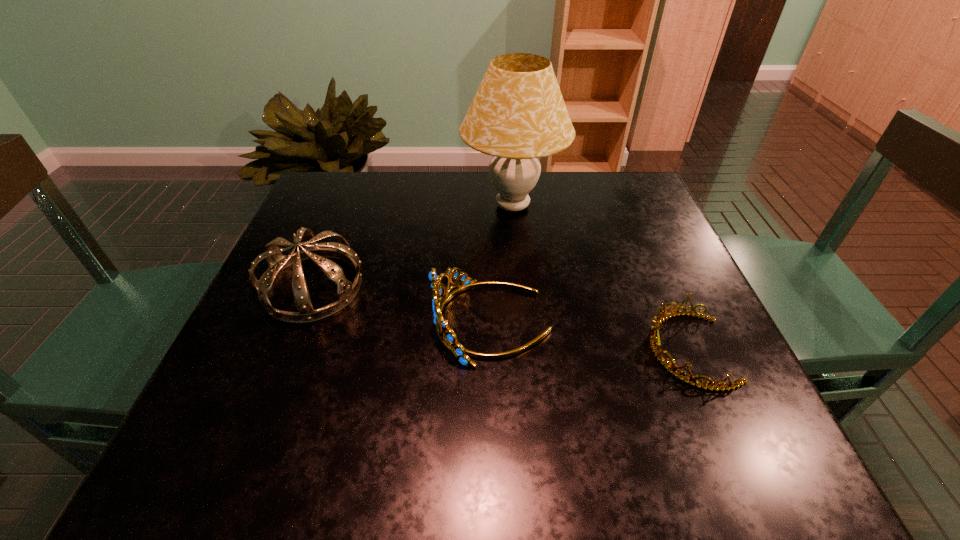
Find the location of a particular element. Image resolution: width=960 pixels, height=540 pixels. free spot located 0.110m on the front-facing side of the second tiara from left to right is located at coordinates (376, 322).

Identify the location of free space located on the front-facing side of the shortest tiara. (613, 350).

You are a GUI agent. You are given a task and a screenshot of the screen. Output one action in this format:
    pyautogui.click(x=<x>, y=<y>)
    Task: Click on the vacant space located on the front-facing side of the shortest tiara
    This screenshot has height=540, width=960.
    Given the screenshot: What is the action you would take?
    coord(596,350)

At what (x,y) coordinates should I click in order to perform the action: click on vacant space located 0.320m on the front-facing side of the shortest tiara. Please return your answer as a coordinate pair (x, y). This screenshot has width=960, height=540. Looking at the image, I should click on (469, 350).

Image resolution: width=960 pixels, height=540 pixels. Identify the location of object located in the far edge section of the desktop. (518, 115).

Locate an element on the screen. object that is at the left edge is located at coordinates (346, 291).

At what (x,y) coordinates should I click in order to perform the action: click on object that is at the right edge. Please return your answer as a coordinate pair (x, y). Looking at the image, I should click on (656, 347).

The width and height of the screenshot is (960, 540). Identify the location of vacant space at the far edge of the desktop. (473, 206).

Image resolution: width=960 pixels, height=540 pixels. In order to click on free location at the near edge in this screenshot , I will do `click(440, 432)`.

This screenshot has width=960, height=540. I want to click on free space at the right edge of the desktop, so click(634, 272).